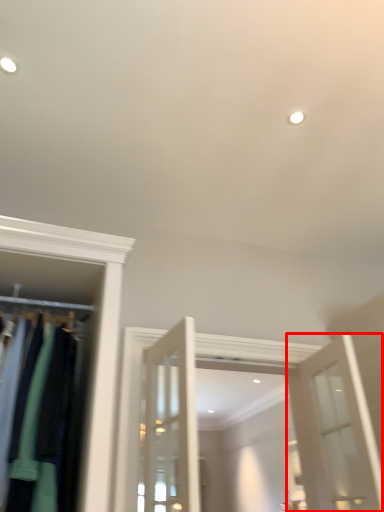
Question: From the image's perspective, where is door (annotated by the red box) located relative to closet?

Choices:
 (A) above
 (B) below

Answer: (B)